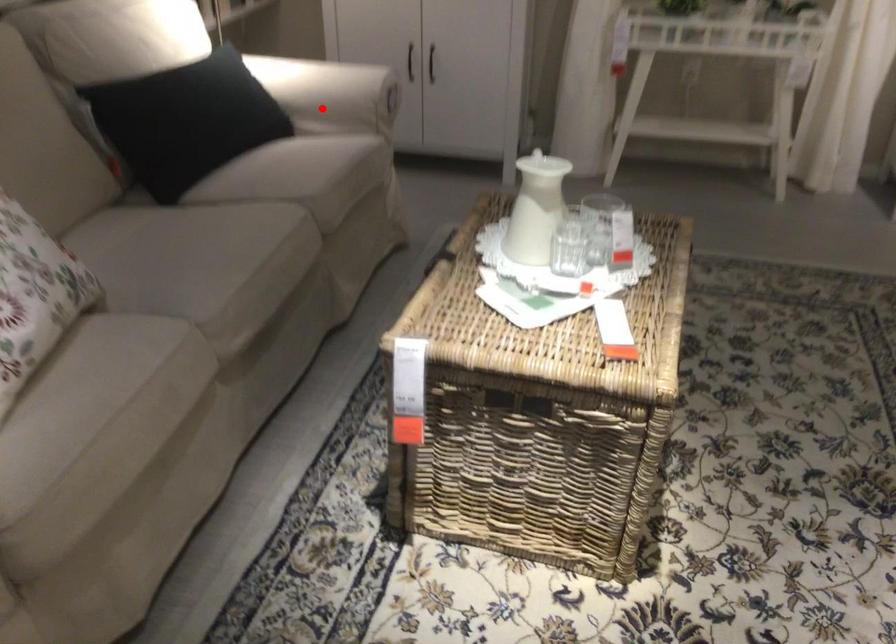
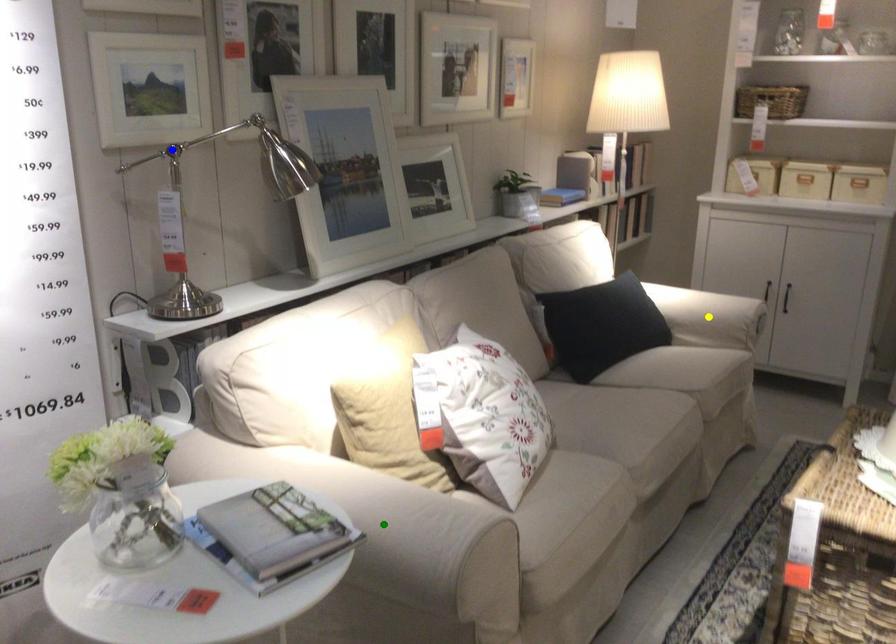
Question: I am providing you with two images of the same scene from different viewpoints. A red point is marked on the first image. You are given multiple points on the second image. Can you choose the point in image 2 that corresponds to the point in image 1?

Choices:
 (A) green point
 (B) blue point
 (C) yellow point

Answer: (C)